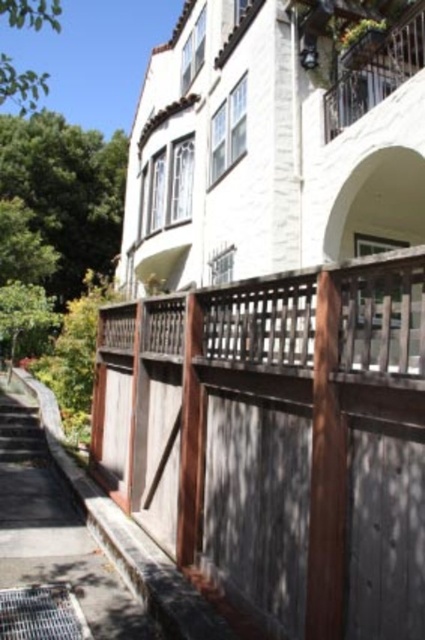
Question: From the image, what is the correct spatial relationship of green leafy tree at upper left in relation to metallic wrought iron balcony at upper right?

Choices:
 (A) below
 (B) above

Answer: (B)

Question: Among these objects, which one is nearest to the camera?

Choices:
 (A) metallic wrought iron balcony at upper right
 (B) green leafy tree at upper left
 (C) brown wood fence at center

Answer: (C)

Question: Can you confirm if green leafy tree at upper left is smaller than metallic wrought iron balcony at upper right?

Choices:
 (A) no
 (B) yes

Answer: (A)

Question: Which of the following is the farthest from the observer?

Choices:
 (A) (363, 84)
 (B) (300, 600)
 (C) (81, 180)

Answer: (C)

Question: Is brown wood fence at center below green leafy tree at upper left?

Choices:
 (A) no
 (B) yes

Answer: (B)

Question: Which object is farther from the camera taking this photo?

Choices:
 (A) metallic wrought iron balcony at upper right
 (B) green leafy tree at upper left

Answer: (B)